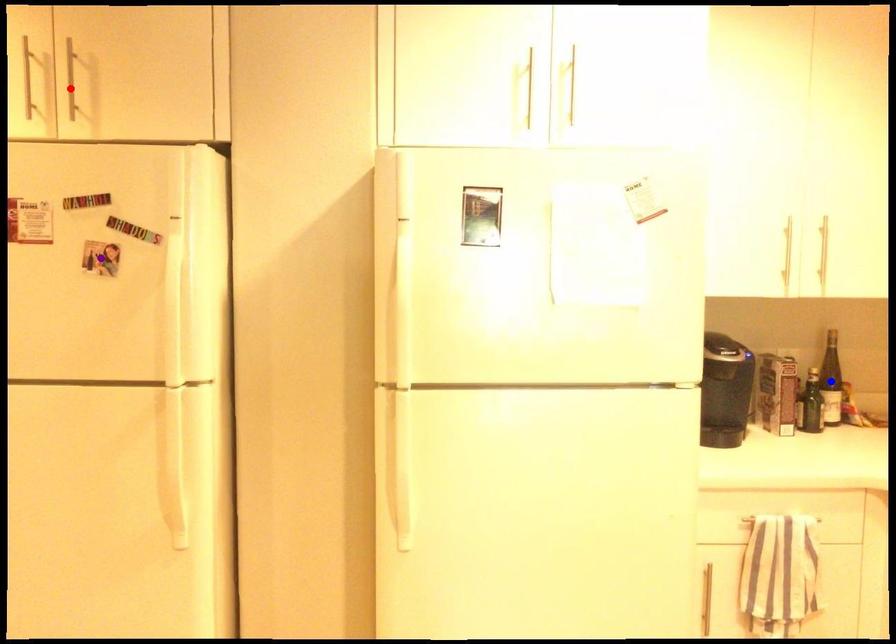
Order these from nearest to farthest:
purple point, red point, blue point

purple point → red point → blue point